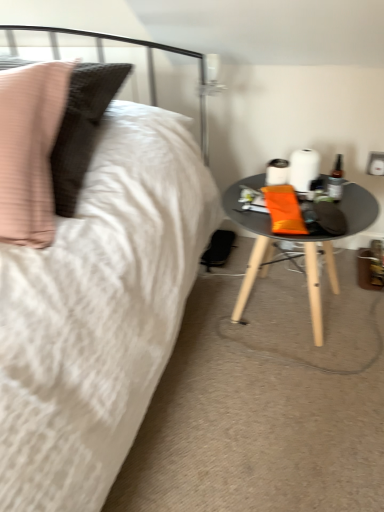
Question: Would you say translucent glass bottle at right is outside white glossy electric outlet at upper right?

Choices:
 (A) yes
 (B) no

Answer: (A)

Question: Is the surface of translucent glass bottle at right in direct contact with white glossy electric outlet at upper right?

Choices:
 (A) yes
 (B) no

Answer: (B)

Question: Can you confirm if translucent glass bottle at right is smaller than white glossy electric outlet at upper right?

Choices:
 (A) no
 (B) yes

Answer: (A)

Question: Can you confirm if translucent glass bottle at right is bigger than white glossy electric outlet at upper right?

Choices:
 (A) yes
 (B) no

Answer: (A)

Question: Would you consider translucent glass bottle at right to be distant from white glossy electric outlet at upper right?

Choices:
 (A) yes
 (B) no

Answer: (B)

Question: From a real-world perspective, is translucent glass bottle at right on white glossy electric outlet at upper right?

Choices:
 (A) no
 (B) yes

Answer: (B)

Question: Is translucent glass bottle at right closer to the viewer compared to matte black table at lower right?

Choices:
 (A) yes
 (B) no

Answer: (B)

Question: From the image's perspective, is translucent glass bottle at right above matte black table at lower right?

Choices:
 (A) no
 (B) yes

Answer: (B)

Question: From the image's perspective, would you say translucent glass bottle at right is shown under matte black table at lower right?

Choices:
 (A) no
 (B) yes

Answer: (A)

Question: Is translucent glass bottle at right not within matte black table at lower right?

Choices:
 (A) no
 (B) yes

Answer: (B)

Question: Can you confirm if translucent glass bottle at right is taller than matte black table at lower right?

Choices:
 (A) yes
 (B) no

Answer: (B)

Question: Does translucent glass bottle at right have a smaller size compared to matte black table at lower right?

Choices:
 (A) yes
 (B) no

Answer: (A)

Question: Is matte black table at lower right not near translucent glass bottle at right?

Choices:
 (A) yes
 (B) no

Answer: (B)